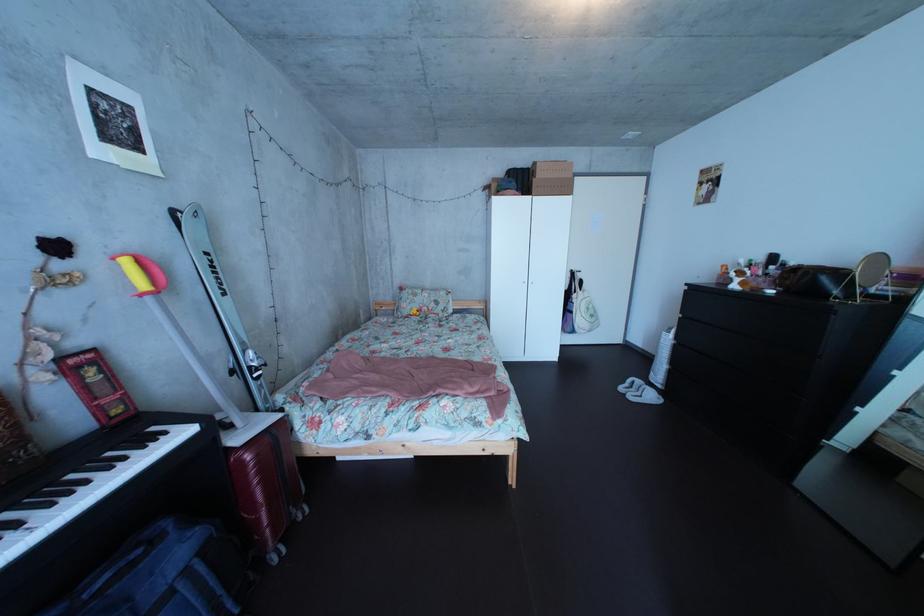
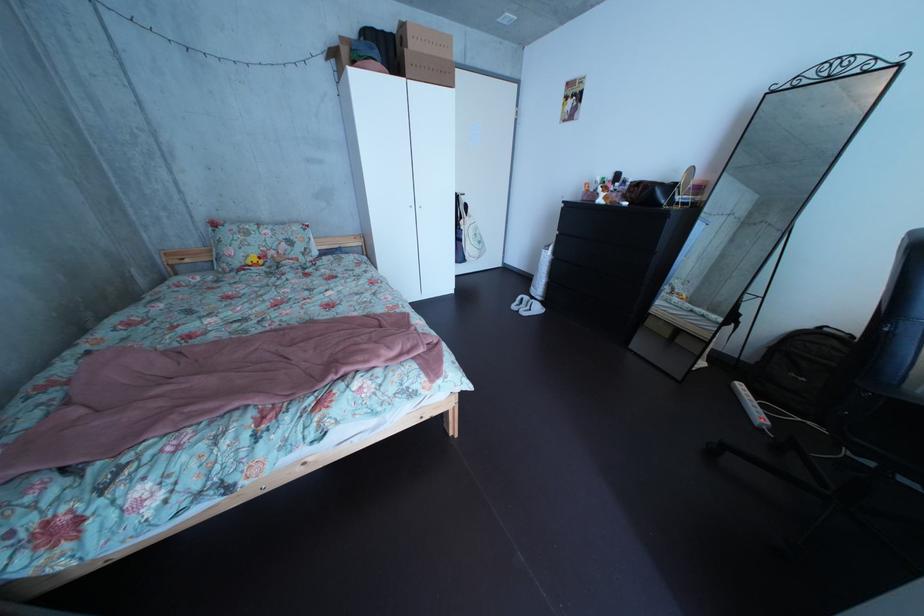
Based on the continuous images, in which direction is the camera rotating?

The camera's rotation is toward right-down.